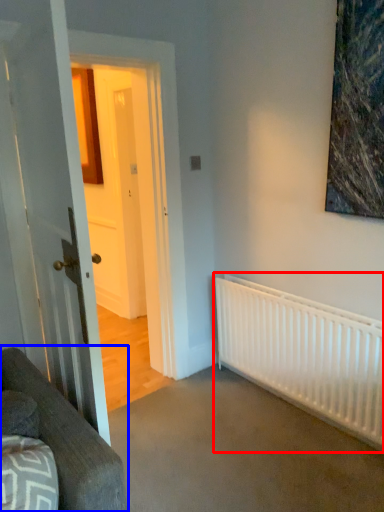
Question: Which object appears closest to the camera in this image, radiator (highlighted by a red box) or studio couch (highlighted by a blue box)?

Choices:
 (A) radiator
 (B) studio couch

Answer: (B)